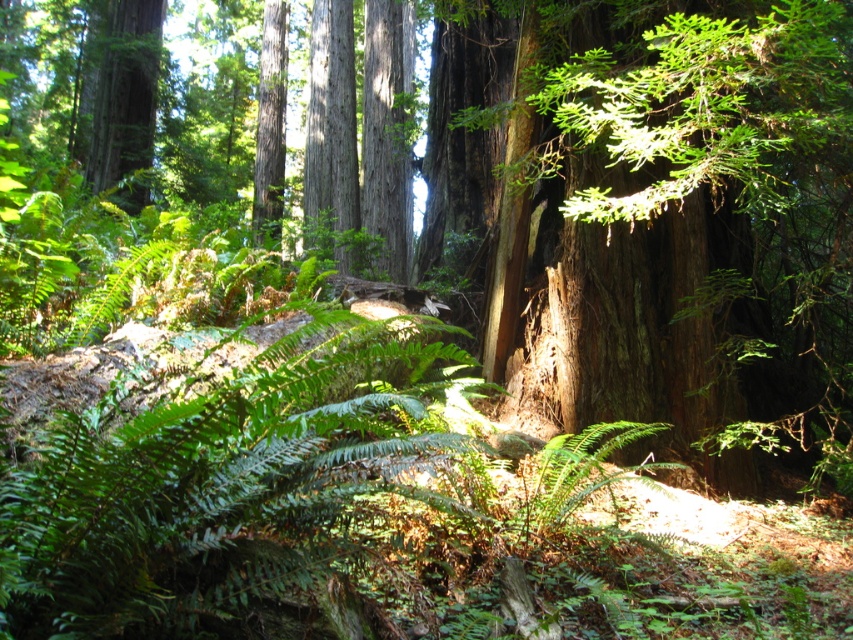
Who is lower down, smooth brown tree trunk at center or smooth brown tree trunk at upper left?

smooth brown tree trunk at center is below.

What do you see at coordinates (608, 298) in the screenshot? This screenshot has height=640, width=853. I see `smooth brown tree trunk at center` at bounding box center [608, 298].

Between point (646, 236) and point (142, 112), which one is positioned behind?

The point (142, 112) is more distant.

Locate an element on the screen. This screenshot has height=640, width=853. smooth brown tree trunk at center is located at coordinates (608, 298).

Which is in front, point (55, 616) or point (643, 403)?

Positioned in front is point (55, 616).

You are a GUI agent. You are given a task and a screenshot of the screen. Output one action in this format:
    pyautogui.click(x=<x>, y=<y>)
    Task: Click on the green leafy fern at center
    Image resolution: width=853 pixels, height=640 pixels.
    Given the screenshot: What is the action you would take?
    pyautogui.click(x=218, y=488)

Which of these two, green leafy fern at center or smooth brown tree trunk at upper left, stands taller?

smooth brown tree trunk at upper left is taller.

Which is behind, point (141, 481) or point (141, 182)?

Point (141, 182)

Where is `green leafy fern at center`? green leafy fern at center is located at coordinates (218, 488).